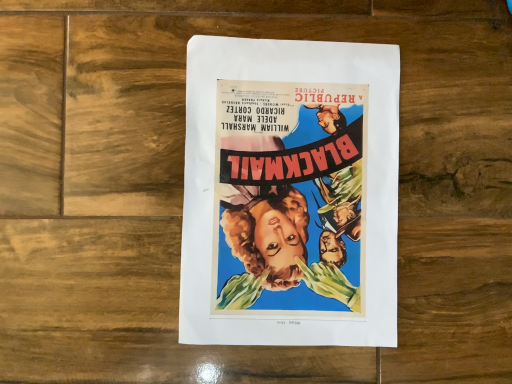
This screenshot has height=384, width=512. What do you see at coordinates (290, 193) in the screenshot?
I see `matte paper poster at center` at bounding box center [290, 193].

Find the location of a particular element. The image size is (512, 384). matte paper poster at center is located at coordinates (290, 193).

Identify the location of matte paper poster at center. The width and height of the screenshot is (512, 384). (290, 193).